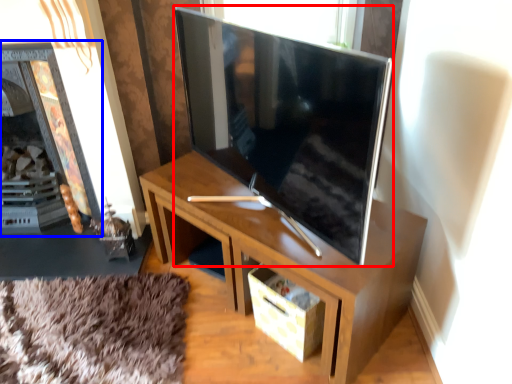
Question: Which object appears farthest to the camera in this image, television (highlighted by a red box) or fireplace (highlighted by a blue box)?

Choices:
 (A) television
 (B) fireplace

Answer: (B)